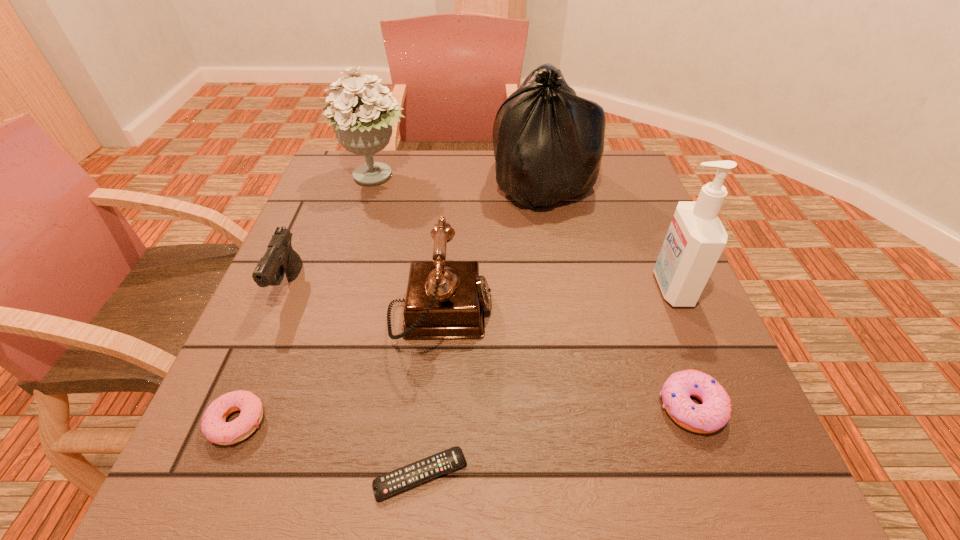
At what (x,y) coordinates should I click in order to perform the action: click on plastic bag. Please return your answer as a coordinate pair (x, y). The image size is (960, 540). Looking at the image, I should click on (548, 142).

In order to click on bouquet in this screenshot , I will do `click(363, 122)`.

Locate an element on the screen. cleansing agent is located at coordinates (696, 237).

Find the location of a particular element. This screenshot has width=960, height=540. telephone is located at coordinates (444, 299).

At what (x,y) coordinates should I click in order to perform the action: click on pistol. Please return your answer as a coordinate pair (x, y). This screenshot has height=540, width=960. Looking at the image, I should click on (279, 259).

Image resolution: width=960 pixels, height=540 pixels. I want to click on the taller doughnut, so click(714, 412).

Where is `the sixth tallest object`? The image size is (960, 540). the sixth tallest object is located at coordinates (714, 412).

Where is `the left doughnut`? the left doughnut is located at coordinates (215, 428).

You are a GUI agent. You are given a task and a screenshot of the screen. Output one action in this format:
    pyautogui.click(x=<x>, y=<y>)
    Task: Click on the shorter doughnut
    This screenshot has width=960, height=540.
    Given the screenshot: What is the action you would take?
    pyautogui.click(x=215, y=428)

Find the location of a particular element. remote control is located at coordinates (396, 481).